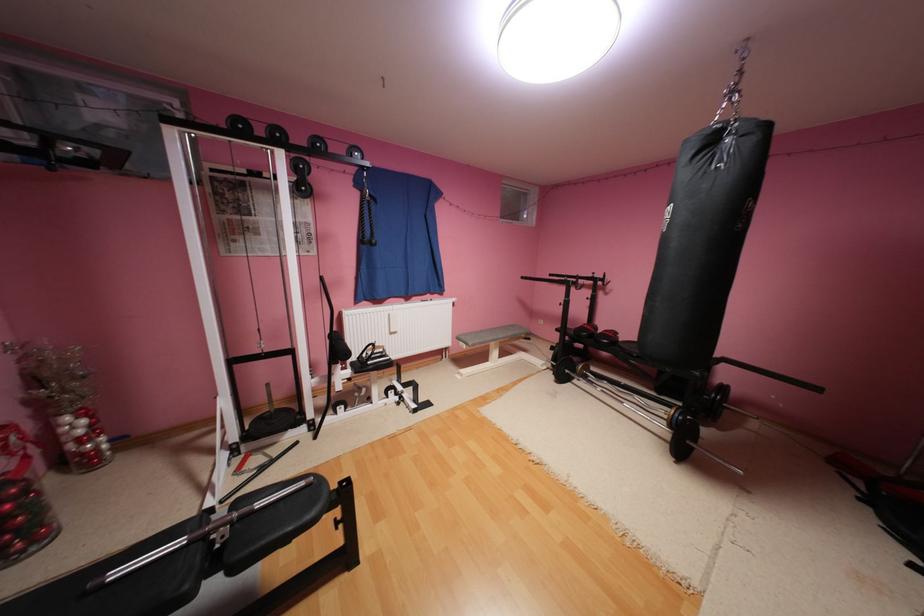
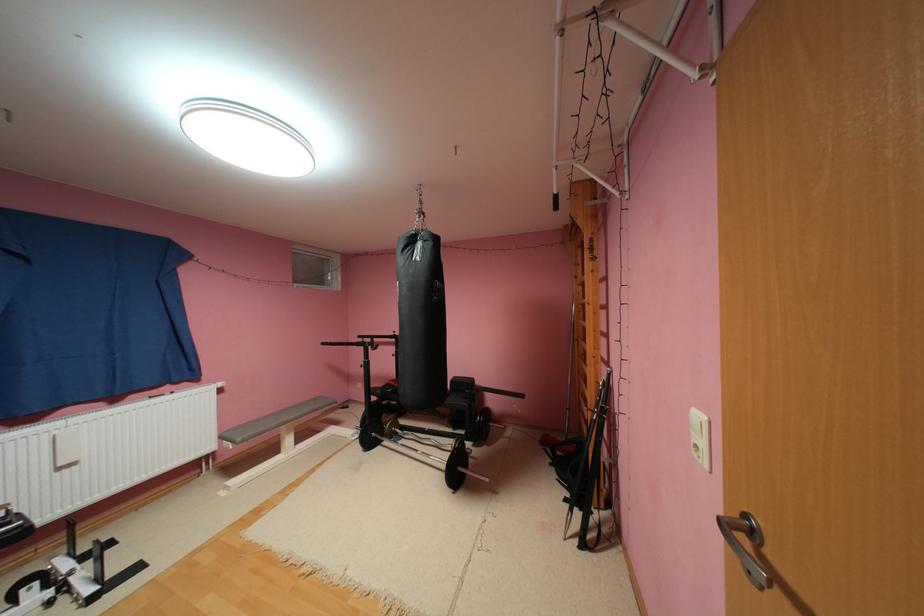
In the second image, find the point that corresponds to (x=675, y=416) in the first image.

(458, 450)